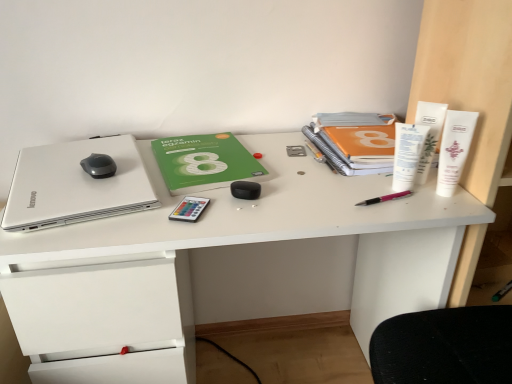
I want to click on free spot in front of green matte paperback book at center, which is the second paperback book in right-to-left order, so 207,213.